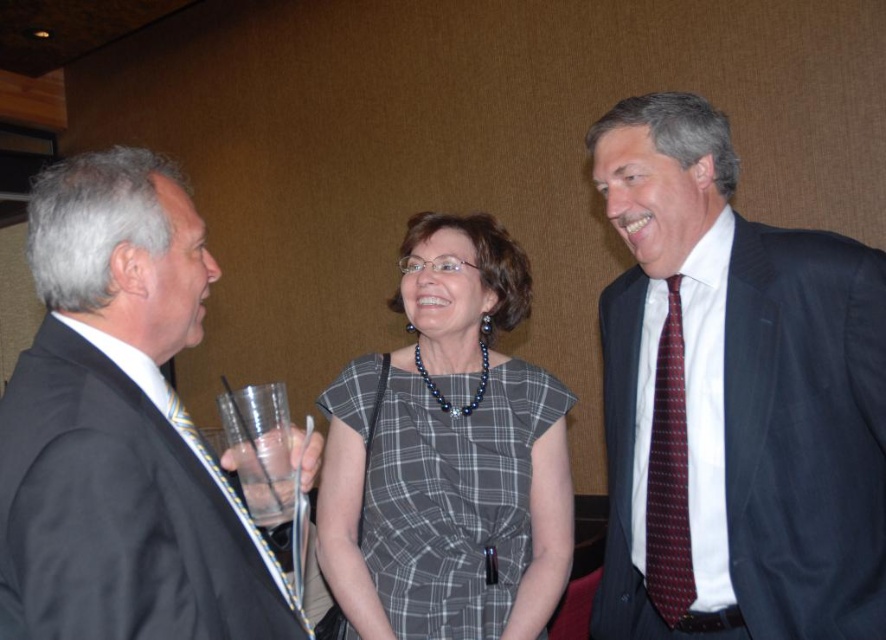
Is dark blue suit at right positioned at the back of matte black suit at left?

Yes, dark blue suit at right is behind matte black suit at left.

Measure the distance between point [876,426] and camera.

A distance of 4.03 feet exists between point [876,426] and camera.

What do you see at coordinates (734, 397) in the screenshot? I see `dark blue suit at right` at bounding box center [734, 397].

Find the location of a particular element. dark blue suit at right is located at coordinates (734, 397).

Which is in front, point (794, 636) or point (456, 548)?

Point (794, 636)

Is dark blue suit at right smaller than plaid fabric dress at center?

Actually, dark blue suit at right might be larger than plaid fabric dress at center.

The height and width of the screenshot is (640, 886). I want to click on dark blue suit at right, so click(x=734, y=397).

Does plaid fabric dress at center appear on the left side of maroon dotted tie at right?

Correct, you'll find plaid fabric dress at center to the left of maroon dotted tie at right.

Between point (475, 264) and point (677, 416), which one is positioned behind?

The point (475, 264) is more distant.

Is point (494, 545) behind point (657, 582)?

Yes, it is.

Image resolution: width=886 pixels, height=640 pixels. What are the coordinates of `plaid fabric dress at center` in the screenshot? It's located at (448, 456).